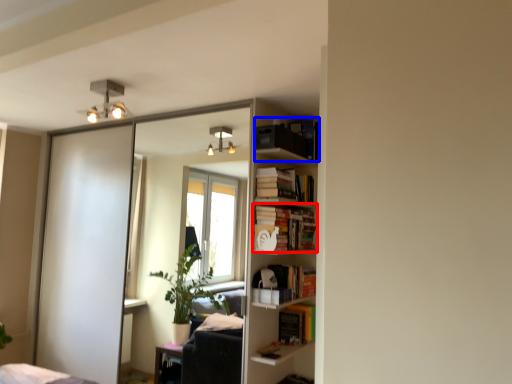
Question: Which object appears closest to the camera in this image, book (highlighted by a red box) or book (highlighted by a blue box)?

Choices:
 (A) book
 (B) book

Answer: (B)